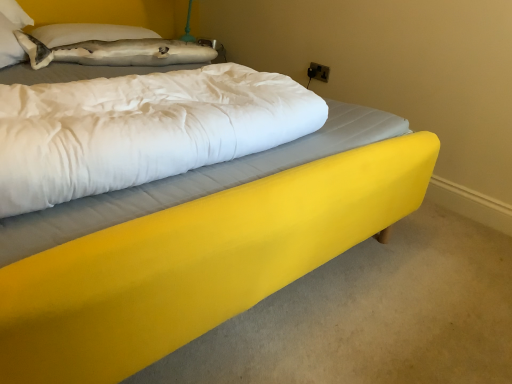
Question: Considering the positions of yellow fabric mattress at center and gray fabric pillow at upper left in the image, is yellow fabric mattress at center taller or shorter than gray fabric pillow at upper left?

Choices:
 (A) short
 (B) tall

Answer: (B)

Question: From the image's perspective, is yellow fabric mattress at center above or below gray fabric pillow at upper left?

Choices:
 (A) below
 (B) above

Answer: (A)

Question: Is yellow fabric mattress at center bigger or smaller than gray fabric pillow at upper left?

Choices:
 (A) big
 (B) small

Answer: (A)

Question: Looking at their shapes, would you say gray fabric pillow at upper left is wider or thinner than yellow fabric mattress at center?

Choices:
 (A) thin
 (B) wide

Answer: (A)

Question: From their relative heights in the image, would you say gray fabric pillow at upper left is taller or shorter than yellow fabric mattress at center?

Choices:
 (A) tall
 (B) short

Answer: (B)

Question: From a real-world perspective, relative to yellow fabric mattress at center, is gray fabric pillow at upper left vertically above or below?

Choices:
 (A) above
 (B) below

Answer: (B)

Question: Is gray fabric pillow at upper left inside or outside of yellow fabric mattress at center?

Choices:
 (A) inside
 (B) outside

Answer: (B)